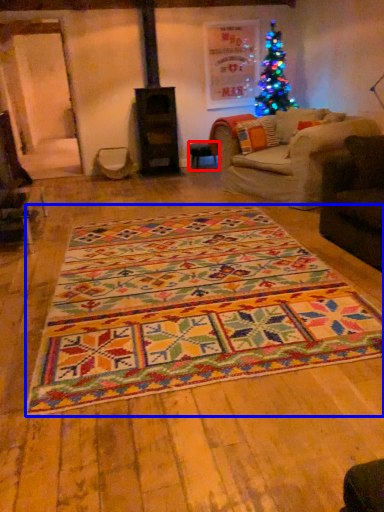
Question: Which point is further to the camera, table (highlighted by a red box) or mat (highlighted by a blue box)?

Choices:
 (A) table
 (B) mat

Answer: (A)